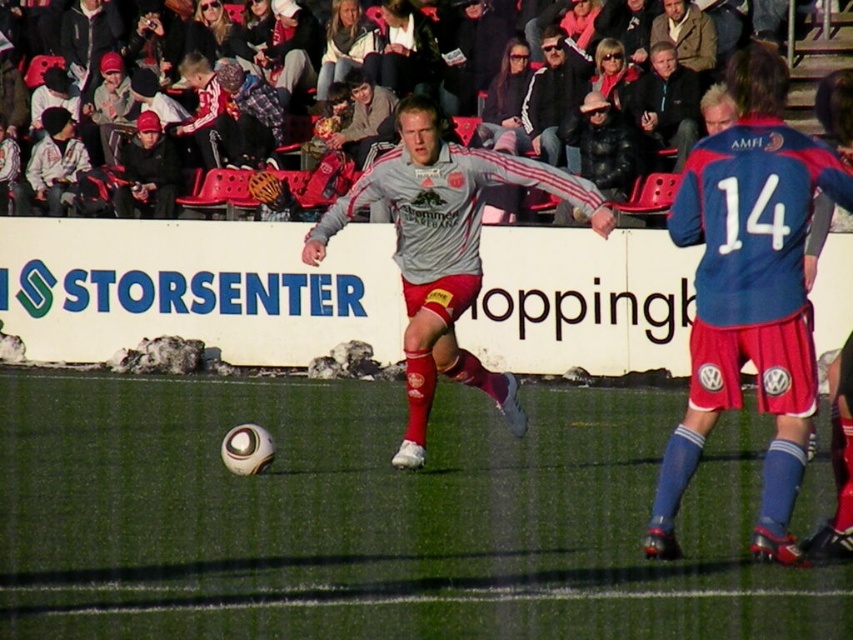
Who is taller, matte gray jersey at center or dark blue jacket at upper center?

Standing taller between the two is matte gray jersey at center.

Does matte gray jersey at center appear on the right side of dark blue jacket at upper center?

Incorrect, matte gray jersey at center is not on the right side of dark blue jacket at upper center.

Is point (421, 154) behind point (693, 93)?

No, it is not.

This screenshot has height=640, width=853. Identify the location of matte gray jersey at center. 444,252.

Is matte gray jersey at center positioned in front of white cotton hoodie at upper left?

That is True.

Does matte gray jersey at center have a larger size compared to white cotton hoodie at upper left?

Yes.

Is point (438, 192) farther from camera compared to point (53, 116)?

No, (438, 192) is closer to viewer.

You are a GUI agent. You are given a task and a screenshot of the screen. Output one action in this format:
    pyautogui.click(x=<x>, y=<y>)
    Task: Click on the matte gray jersey at center
    The width and height of the screenshot is (853, 640).
    Given the screenshot: What is the action you would take?
    pyautogui.click(x=444, y=252)

Who is higher up, blue jersey at right or matte gray jersey at center?

Positioned higher is matte gray jersey at center.

Looking at this image, is blue jersey at right bigger than matte gray jersey at center?

Actually, blue jersey at right might be smaller than matte gray jersey at center.

Is point (773, 449) closer to camera compared to point (560, 189)?

Yes, it is.

Locate an element on the screen. The height and width of the screenshot is (640, 853). blue jersey at right is located at coordinates pos(749,292).